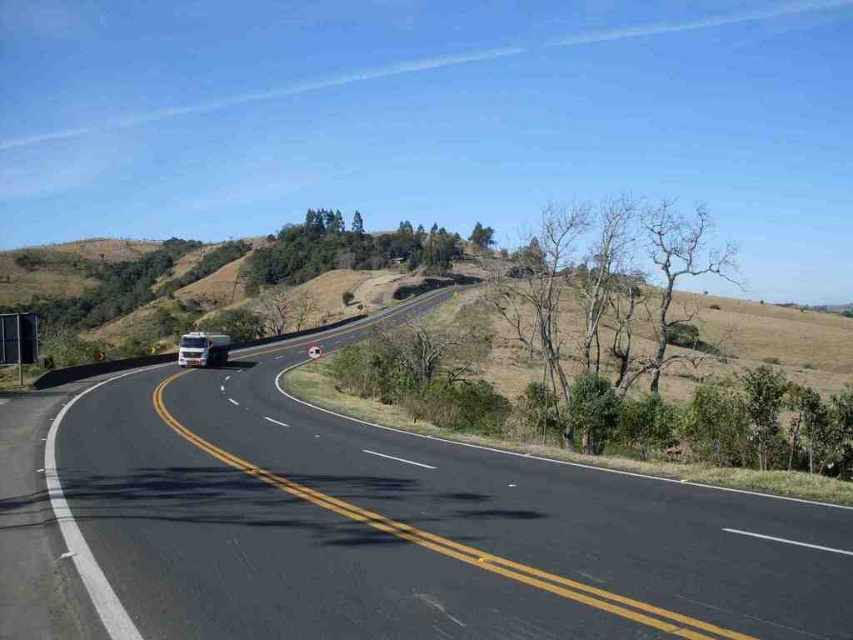
Based on the photo, you are a drone operator planning to fly a drone over the two lanes of the road shown in the image. The drone must stay above the road but avoid the black asphalt highway at center marked by point (x=405, y=529). Which lane should the drone fly over?

The drone should fly over the right lane since the black asphalt highway at center is marked by point (x=405, y=529), which is the central area. The left lane is on the viewer side, and the right lane is away from the viewer. Since the drone must avoid the central highway, it should choose the right lane to stay above the road while avoiding the central area.

From the picture: You are driving a car and see two points on the road ahead. The first point is at coordinate point(96, 500) and the second is at point(187, 362). Which point is closer to your current position?

Point(96, 500) is in front of point(187, 362), so the closer point to your current position is point(187, 362).

You are driving a car and see the black asphalt highway at center and the white glossy truck at center ahead. Which object is located to the right of the other?

The black asphalt highway at center is positioned on the right side of white glossy truck at center.